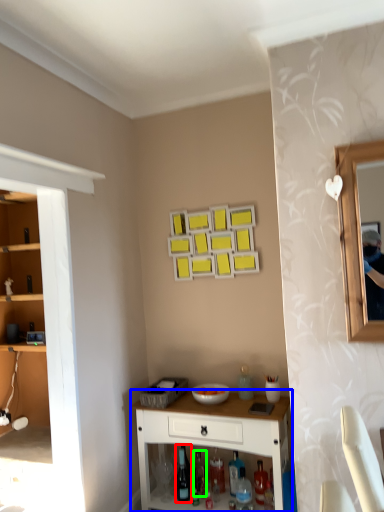
Question: Which object is the closest to the wine bottle (highlighted by a red box)? Choose among these: desk (highlighted by a blue box) or bottle (highlighted by a green box).

Choices:
 (A) desk
 (B) bottle

Answer: (B)